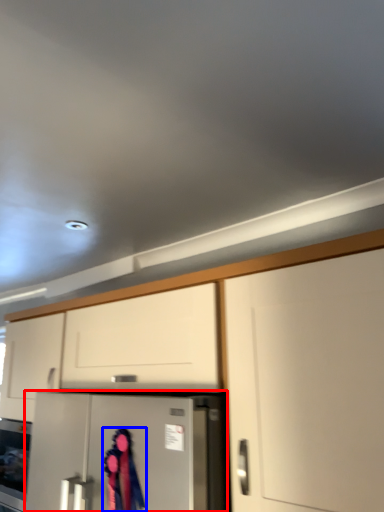
Question: Which object is closer to the camera taking this photo, refrigerator (highlighted by a red box) or woman (highlighted by a blue box)?

Choices:
 (A) refrigerator
 (B) woman

Answer: (A)